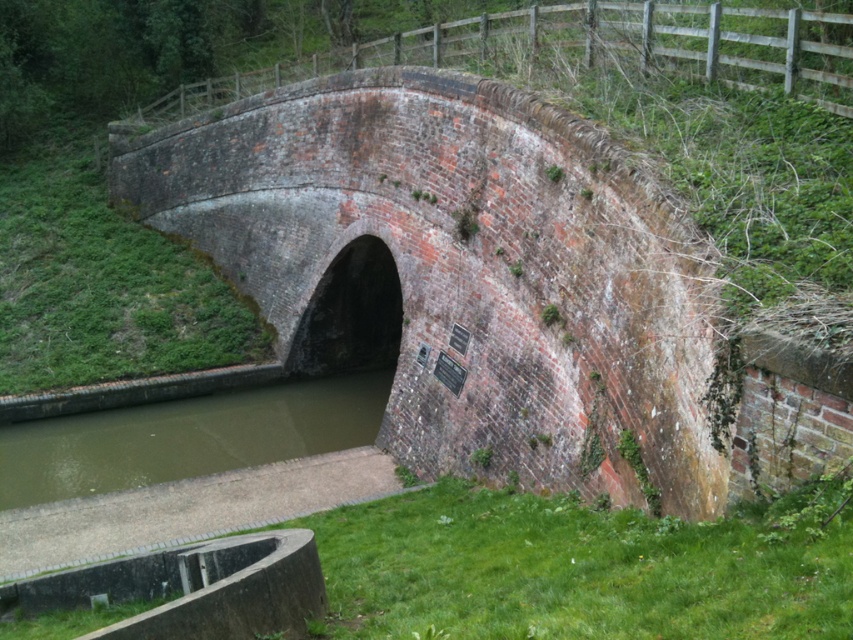
Question: In this image, where is red brick tunnel at center located relative to green murky water at lower left?

Choices:
 (A) above
 (B) below

Answer: (A)

Question: Does red brick tunnel at center appear under green murky water at lower left?

Choices:
 (A) yes
 (B) no

Answer: (B)

Question: Can you confirm if red brick tunnel at center is thinner than green murky water at lower left?

Choices:
 (A) yes
 (B) no

Answer: (B)